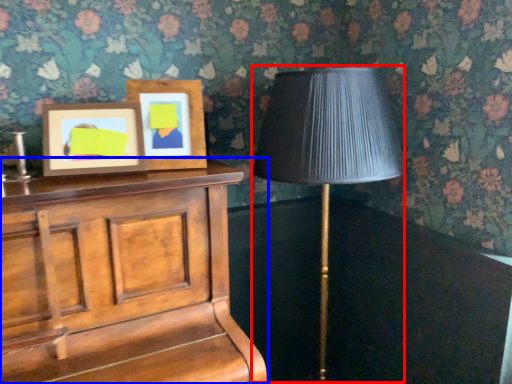
Question: Which object is closer to the camera taking this photo, table lamp (highlighted by a red box) or furniture (highlighted by a blue box)?

Choices:
 (A) table lamp
 (B) furniture

Answer: (B)